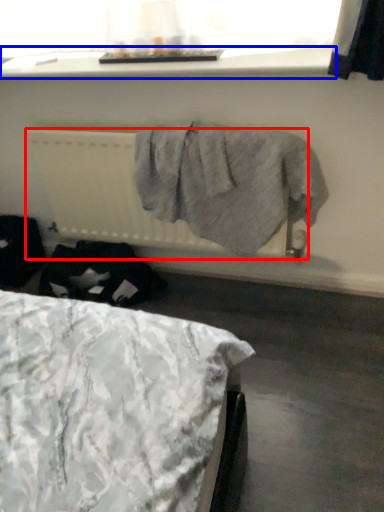
Question: Which object appears farthest to the camera in this image, radiator (highlighted by a red box) or window sill (highlighted by a blue box)?

Choices:
 (A) radiator
 (B) window sill

Answer: (A)